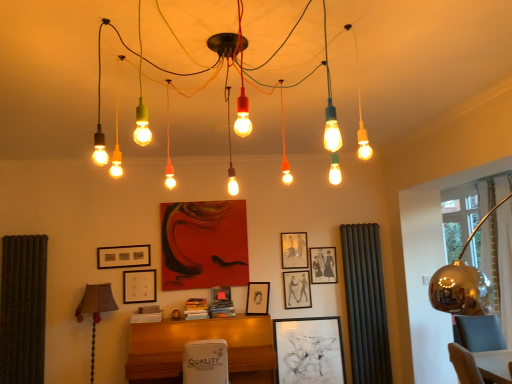
Question: Is black matte picture frame at center, arranged as the 8th picture frame when viewed from the left, closer to the viewer compared to matte black picture frame at center, the 1th picture frame from the right?

Choices:
 (A) no
 (B) yes

Answer: (B)

Question: Is matte black picture frame at center, the 1th picture frame from the right, completely or partially inside black matte picture frame at center, which ranks as the 2th picture frame in right-to-left order?

Choices:
 (A) no
 (B) yes

Answer: (A)

Question: Is black matte picture frame at center, arranged as the 8th picture frame when viewed from the left, bigger than matte black picture frame at center, the 1th picture frame from the right?

Choices:
 (A) yes
 (B) no

Answer: (A)

Question: Considering the relative positions of black matte picture frame at center, arranged as the 8th picture frame when viewed from the left, and matte black picture frame at center, the 9th picture frame when ordered from left to right, in the image provided, is black matte picture frame at center, arranged as the 8th picture frame when viewed from the left, to the right of matte black picture frame at center, the 9th picture frame when ordered from left to right, from the viewer's perspective?

Choices:
 (A) no
 (B) yes

Answer: (A)

Question: Can you confirm if black matte picture frame at center, which ranks as the 2th picture frame in right-to-left order, is shorter than matte black picture frame at center, the 1th picture frame from the right?

Choices:
 (A) yes
 (B) no

Answer: (B)

Question: Looking at their shapes, would you say matte black picture frame at upper center, the 4th picture frame viewed from the right, is wider or thinner than matte black picture frame at center, positioned as the third picture frame in right-to-left order?

Choices:
 (A) wide
 (B) thin

Answer: (A)

Question: Considering the positions of matte black picture frame at upper center, the 4th picture frame viewed from the right, and matte black picture frame at center, positioned as the third picture frame in right-to-left order, in the image, is matte black picture frame at upper center, the 4th picture frame viewed from the right, taller or shorter than matte black picture frame at center, positioned as the third picture frame in right-to-left order,?

Choices:
 (A) short
 (B) tall

Answer: (A)

Question: From the image's perspective, is matte black picture frame at upper center, arranged as the 6th picture frame when viewed from the left, above or below matte black picture frame at center, positioned as the third picture frame in right-to-left order?

Choices:
 (A) below
 (B) above

Answer: (B)

Question: Visually, is matte black picture frame at upper center, arranged as the 6th picture frame when viewed from the left, positioned to the left or to the right of matte black picture frame at center, positioned as the third picture frame in right-to-left order?

Choices:
 (A) right
 (B) left

Answer: (B)

Question: Is black fabric curtain at right bigger or smaller than matte black picture frame at center, acting as the sixth picture frame starting from the right?

Choices:
 (A) small
 (B) big

Answer: (B)

Question: Is point click(380, 284) positioned closer to the camera than point click(216, 291)?

Choices:
 (A) closer
 (B) farther

Answer: (B)

Question: Considering the relative positions of black fabric curtain at right and matte black picture frame at center, marked as the fourth picture frame in a left-to-right arrangement, in the image provided, is black fabric curtain at right to the left or to the right of matte black picture frame at center, marked as the fourth picture frame in a left-to-right arrangement,?

Choices:
 (A) left
 (B) right

Answer: (B)

Question: In terms of width, does black fabric curtain at right look wider or thinner when compared to matte black picture frame at center, acting as the sixth picture frame starting from the right?

Choices:
 (A) thin
 (B) wide

Answer: (B)

Question: From a real-world perspective, is matte black picture frame at upper center, arranged as the 6th picture frame when viewed from the left, positioned above or below black matte picture frame at center, arranged as the 8th picture frame when viewed from the left?

Choices:
 (A) below
 (B) above

Answer: (B)

Question: From the image's perspective, is matte black picture frame at upper center, arranged as the 6th picture frame when viewed from the left, above or below black matte picture frame at center, which ranks as the 2th picture frame in right-to-left order?

Choices:
 (A) below
 (B) above

Answer: (B)